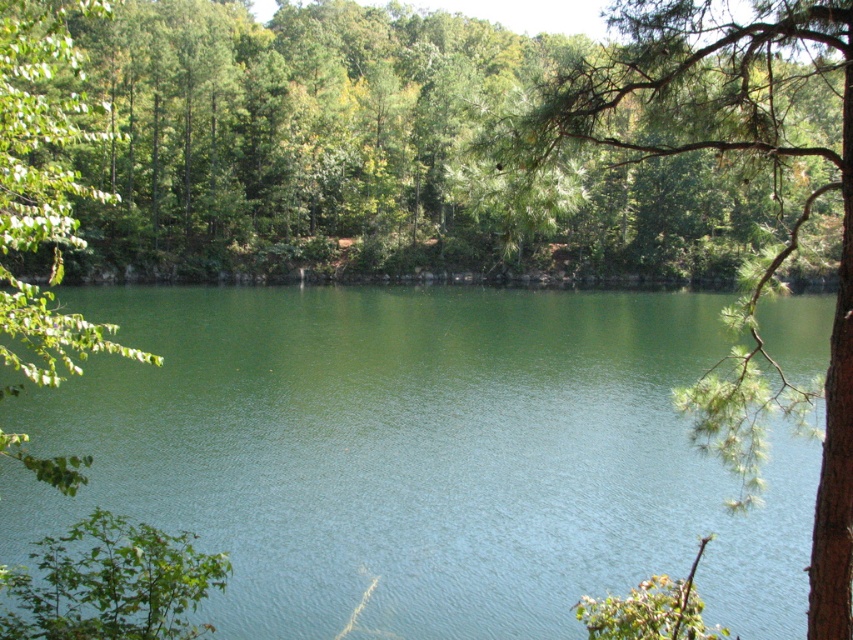
Question: Is green liquid water at center smaller than green pine branch at upper right?

Choices:
 (A) yes
 (B) no

Answer: (A)

Question: Which point appears farthest from the camera in this image?

Choices:
 (A) (616, 560)
 (B) (741, 481)

Answer: (B)

Question: Does green liquid water at center have a lesser width compared to green pine branch at upper right?

Choices:
 (A) yes
 (B) no

Answer: (B)

Question: In this image, where is green liquid water at center located relative to green pine branch at upper right?

Choices:
 (A) left
 (B) right

Answer: (A)

Question: Among these points, which one is nearest to the camera?

Choices:
 (A) (840, 573)
 (B) (503, 502)

Answer: (A)

Question: Which object appears farthest from the camera in this image?

Choices:
 (A) green liquid water at center
 (B) green pine branch at upper right

Answer: (A)